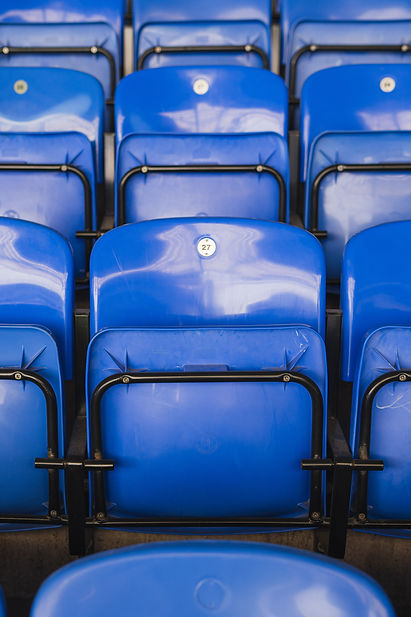
I want to click on blue seats, so click(x=168, y=606), click(x=23, y=413), click(x=200, y=419), click(x=382, y=413), click(x=82, y=100), click(x=369, y=110), click(x=330, y=10), click(x=217, y=20), click(x=74, y=23).